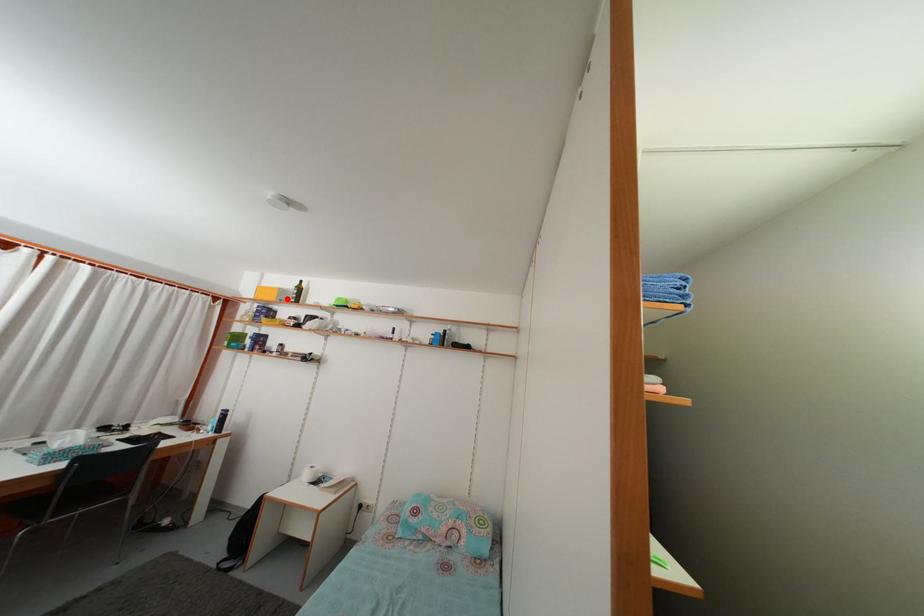
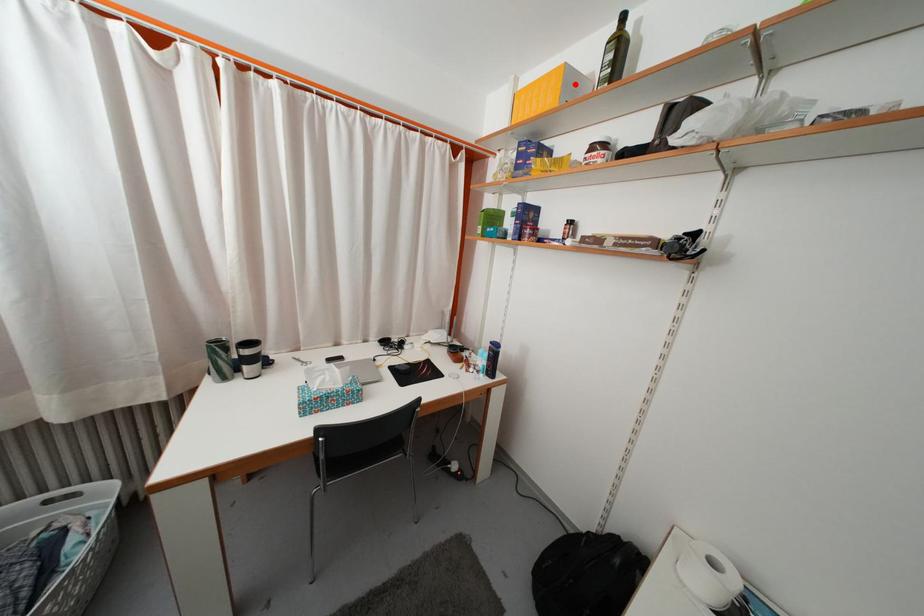
I am providing you with two images of the same scene from different viewpoints. A red point is marked on the first image and another point is marked on the second image. Do the highlighted points in image1 and image2 indicate the same real-world spot?

Yes